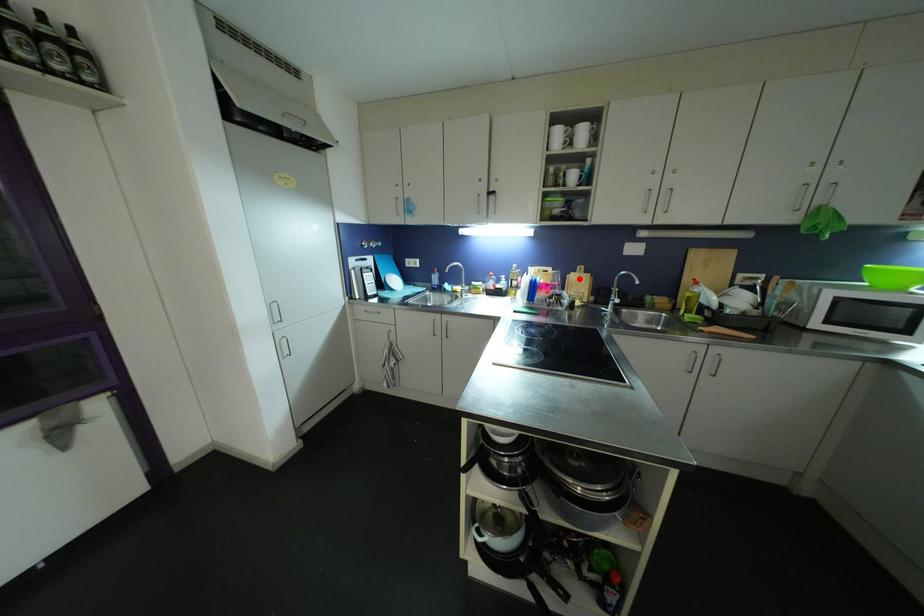
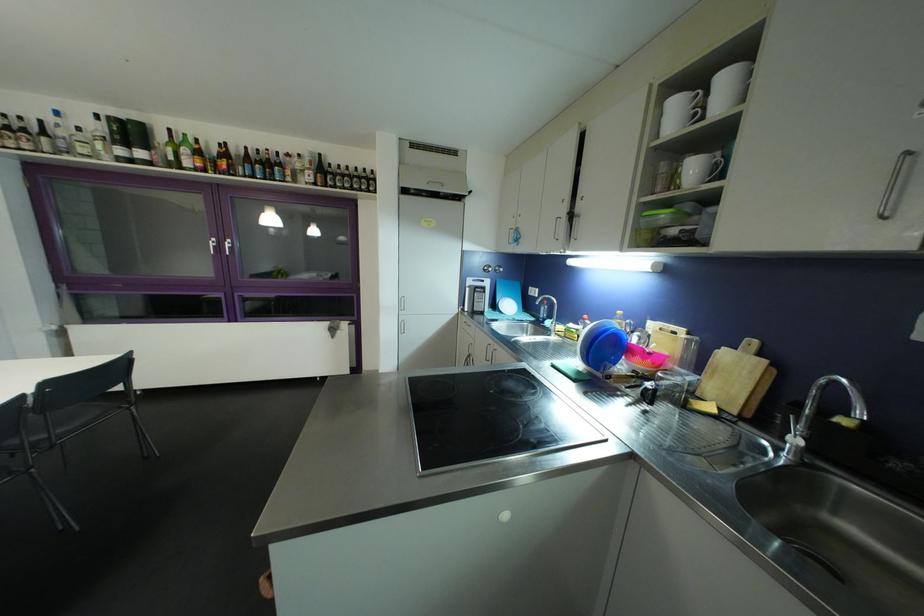
In the second image, find the point that corresponds to the highlighted location in the first image.

(732, 358)